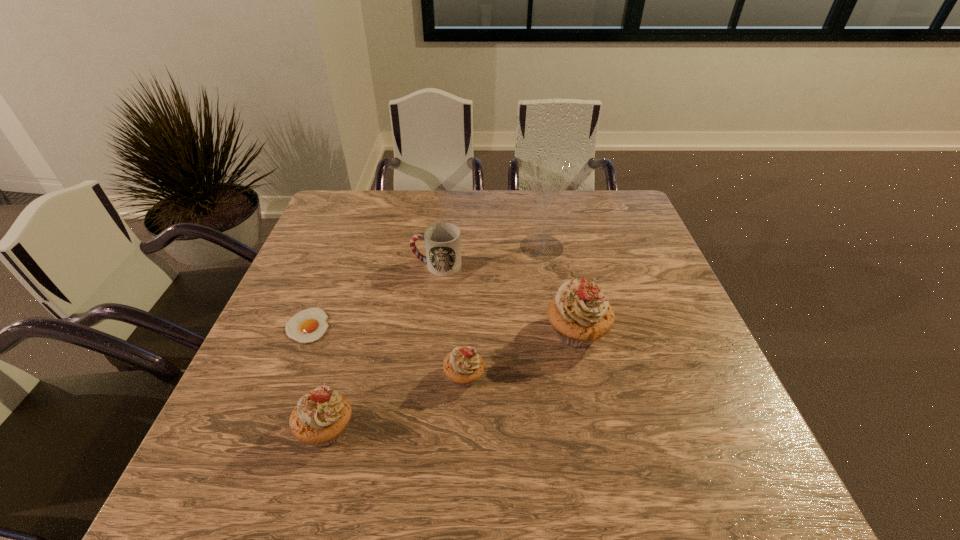
Please point a spot on the right to add another cupcake. Please provide its 2D coordinates. Your answer should be formatted as a tuple, i.e. [(x, y)], where the tuple contains the x and y coordinates of a point satisfying the conditions above.

[(672, 296)]